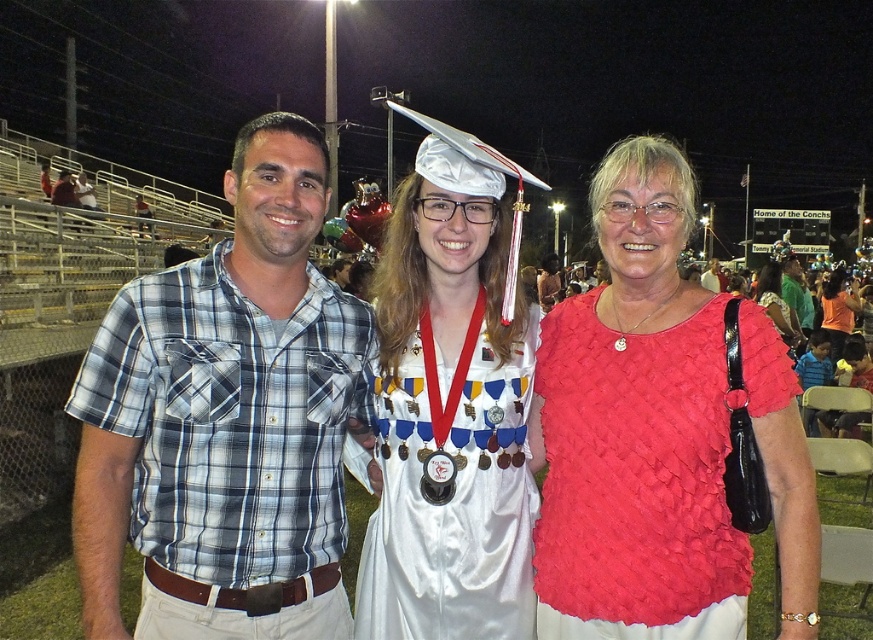
You are a photographer at the graduation event and want to ensure both the red woven blouse at center and the orange fabric dress at center are visible in the photo. Given their widths, which one should you focus on to capture both without cropping?

The red woven blouse at center is narrower than the orange fabric dress at center, so focusing on the orange fabric dress at center would allow both to be captured without cropping since it is wider and can accommodate the narrower blouse within the frame.